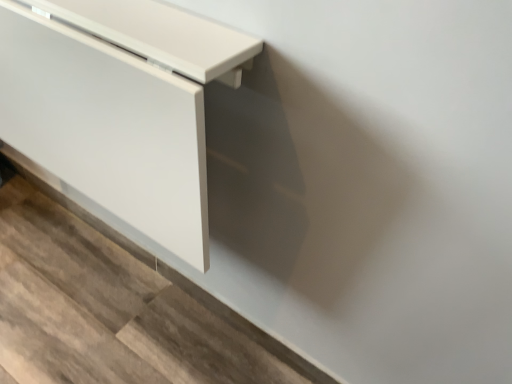
Describe the element at coordinates (120, 105) in the screenshot. I see `white matte cabinet at lower left` at that location.

Locate an element on the screen. The image size is (512, 384). white matte cabinet at lower left is located at coordinates (120, 105).

The image size is (512, 384). I want to click on white matte cabinet at lower left, so click(x=120, y=105).